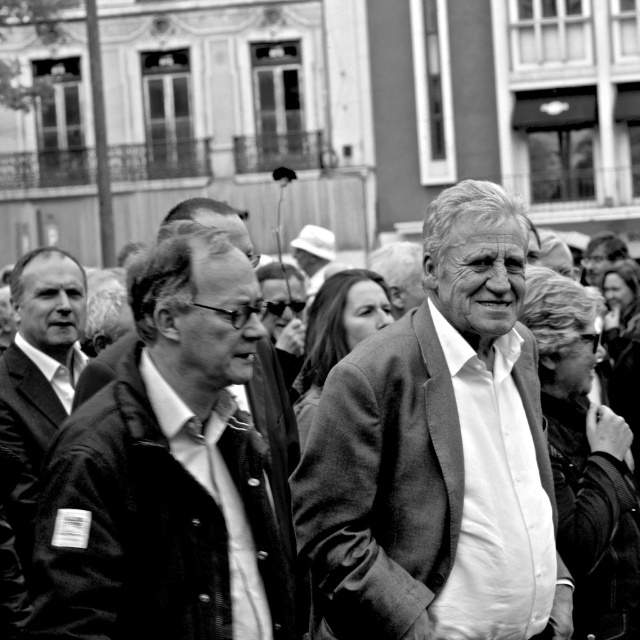
Between point (541, 627) and point (3, 445), which one is positioned in front?

Point (541, 627) is more forward.

What do you see at coordinates (436, 452) in the screenshot? I see `smooth gray blazer at center` at bounding box center [436, 452].

Locate an element on the screen. smooth gray blazer at center is located at coordinates (436, 452).

You are a GUI agent. You are given a task and a screenshot of the screen. Output one action in this format:
    pyautogui.click(x=<x>, y=<y>)
    Task: Click on the smooth gray blazer at center
    Image resolution: width=640 pixels, height=640 pixels.
    Given the screenshot: What is the action you would take?
    pyautogui.click(x=436, y=452)

Between smooth gray blazer at center and dark gray jacket at center, which one appears on the left side from the viewer's perspective?

From the viewer's perspective, dark gray jacket at center appears more on the left side.

Does smooth gray blazer at center appear over dark gray jacket at center?

Correct, smooth gray blazer at center is located above dark gray jacket at center.

The width and height of the screenshot is (640, 640). What do you see at coordinates (436, 452) in the screenshot?
I see `smooth gray blazer at center` at bounding box center [436, 452].

What are the coordinates of `smooth gray blazer at center` in the screenshot? It's located at (436, 452).

Find the location of a particular element. dark gray jacket at center is located at coordinates (163, 472).

Looking at this image, measure the distance between point (176, 474) and camera.

They are 33.89 meters apart.

Where is `dark gray jacket at center`? The height and width of the screenshot is (640, 640). dark gray jacket at center is located at coordinates (163, 472).

Find the location of `dark gray jacket at center`. dark gray jacket at center is located at coordinates (163, 472).